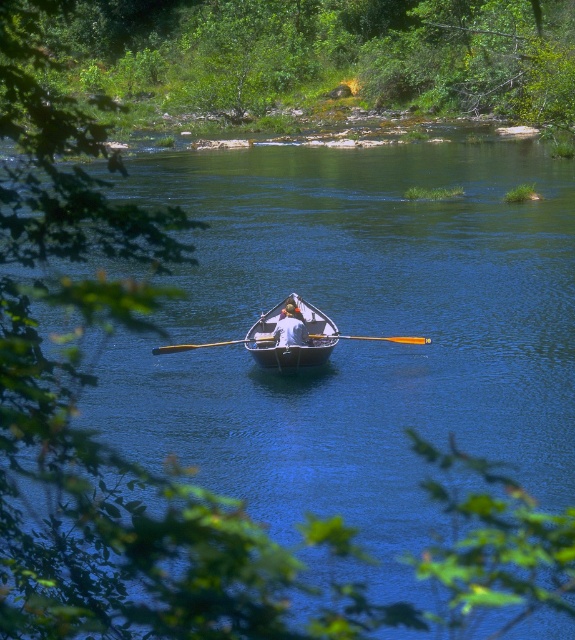
You are a photographer planning to capture the wooden rowboat at center and the wooden paddle at center in a single frame. Considering their widths, which object should you position closer to the center of your camera frame to ensure both fit within the shot?

The wooden rowboat at center is thinner than the wooden paddle at center, so positioning the wooden rowboat at center closer to the center of the camera frame would allow both objects to fit within the shot since it takes up less space.

You are a photographer planning to take a photo of the wooden rowboat at center and the wooden paddle at center in the river scene. If you want to ensure both objects are clearly visible in the frame, which object should you focus on first to maintain clarity, considering their sizes?

The wooden rowboat at center is bigger than the wooden paddle at center, so focusing on the wooden rowboat at center first will ensure it is clear, and the paddle should also be in focus due to its proximity in size and position.